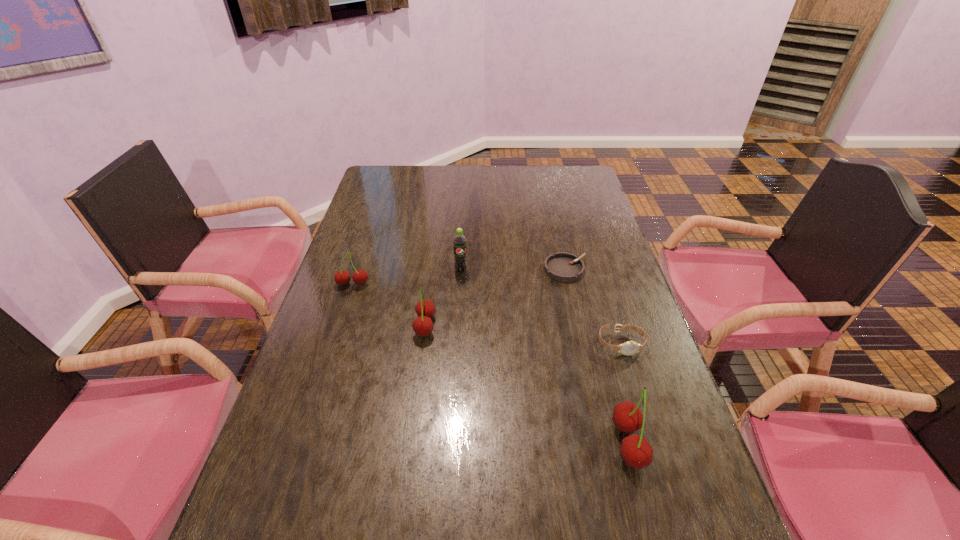
Locate which cherry ranks in proximity to the leftmost object. Please provide its 2D coordinates. Your answer should be formatted as a tuple, i.e. [(x, y)], where the tuple contains the x and y coordinates of a point satisfying the conditions above.

[(422, 325)]

Locate an element on the screen. cherry that is the second closest to the nearest cherry is located at coordinates (359, 277).

The height and width of the screenshot is (540, 960). I want to click on vacant region that satisfies the following two spatial constraints: 1. on the front label of the fourth object from right to left; 2. on the surface of the second nearest cherry, so click(x=458, y=326).

You are a GUI agent. You are given a task and a screenshot of the screen. Output one action in this format:
    pyautogui.click(x=<x>, y=<y>)
    Task: Click on the free space in the image that satisfies the following two spatial constraints: 1. on the front label of the soda; 2. on the surface of the second nearest cherry
    
    Given the screenshot: What is the action you would take?
    pyautogui.click(x=458, y=326)